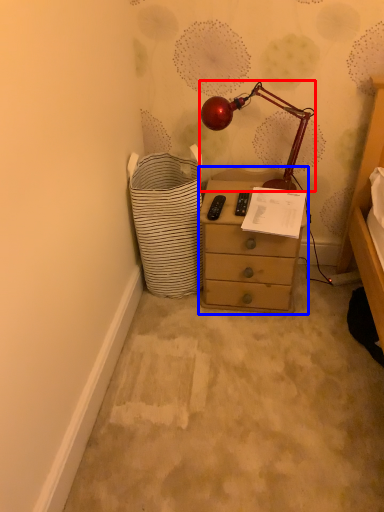
Question: Which point is closer to the camera, lamp (highlighted by a red box) or chest of drawers (highlighted by a blue box)?

Choices:
 (A) lamp
 (B) chest of drawers

Answer: (A)